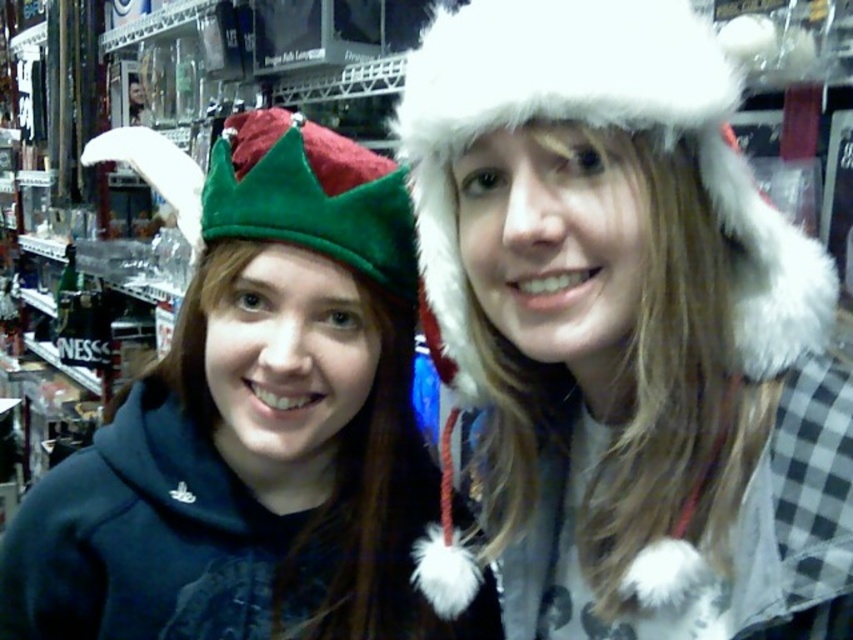
Question: Does white furry hat at upper right have a greater width compared to velvet green crown at upper left?

Choices:
 (A) no
 (B) yes

Answer: (A)

Question: Is the position of white furry hat at upper right less distant than that of velvet green crown at upper left?

Choices:
 (A) yes
 (B) no

Answer: (A)

Question: Which of the following is the farthest from the observer?

Choices:
 (A) (606, 92)
 (B) (190, 429)

Answer: (B)

Question: Among these points, which one is farthest from the camera?

Choices:
 (A) (77, 573)
 (B) (737, 561)

Answer: (A)

Question: Does white furry hat at upper right appear under velvet green crown at upper left?

Choices:
 (A) yes
 (B) no

Answer: (B)

Question: Which point is farther to the camera?

Choices:
 (A) (381, 564)
 (B) (535, 403)

Answer: (A)